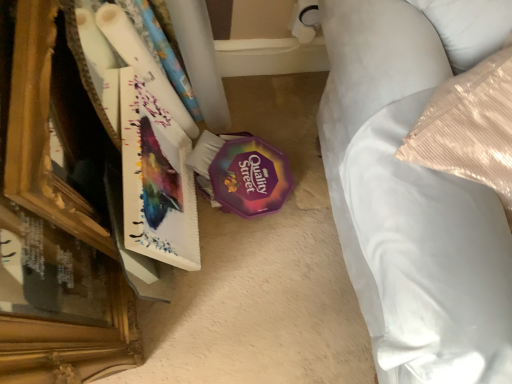
Question: Based on their sizes in the image, would you say white satin bed at right is bigger or smaller than matte paperboard book at left?

Choices:
 (A) small
 (B) big

Answer: (B)

Question: Would you say white satin bed at right is inside or outside matte paperboard book at left?

Choices:
 (A) outside
 (B) inside

Answer: (A)

Question: In terms of height, does white satin bed at right look taller or shorter compared to matte paperboard book at left?

Choices:
 (A) tall
 (B) short

Answer: (A)

Question: Is matte paperboard book at left taller or shorter than white satin bed at right?

Choices:
 (A) tall
 (B) short

Answer: (B)

Question: From a real-world perspective, relative to white satin bed at right, is matte paperboard book at left vertically above or below?

Choices:
 (A) above
 (B) below

Answer: (B)

Question: Considering their positions, is matte paperboard book at left located in front of or behind white satin bed at right?

Choices:
 (A) behind
 (B) front

Answer: (A)

Question: From the image's perspective, is matte paperboard book at left located above or below white satin bed at right?

Choices:
 (A) above
 (B) below

Answer: (B)